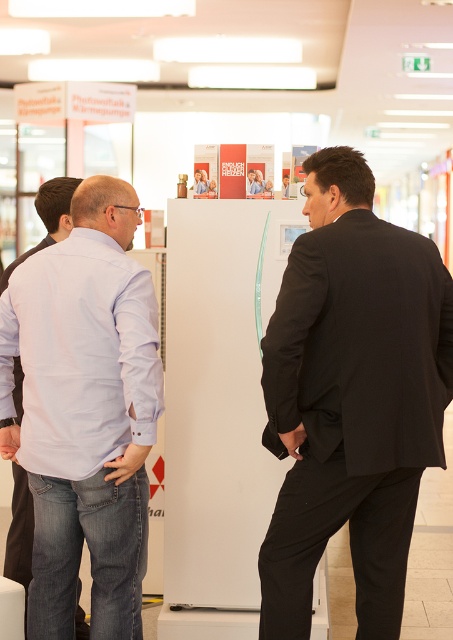
Who is taller, black suit at center or light blue denim jeans at left?

With more height is black suit at center.

Locate an element on the screen. Image resolution: width=453 pixels, height=640 pixels. black suit at center is located at coordinates (351, 397).

Find the location of a particular element. This screenshot has width=453, height=640. black suit at center is located at coordinates pyautogui.click(x=351, y=397).

Locate an element on the screen. This screenshot has width=453, height=640. black suit at center is located at coordinates (351, 397).